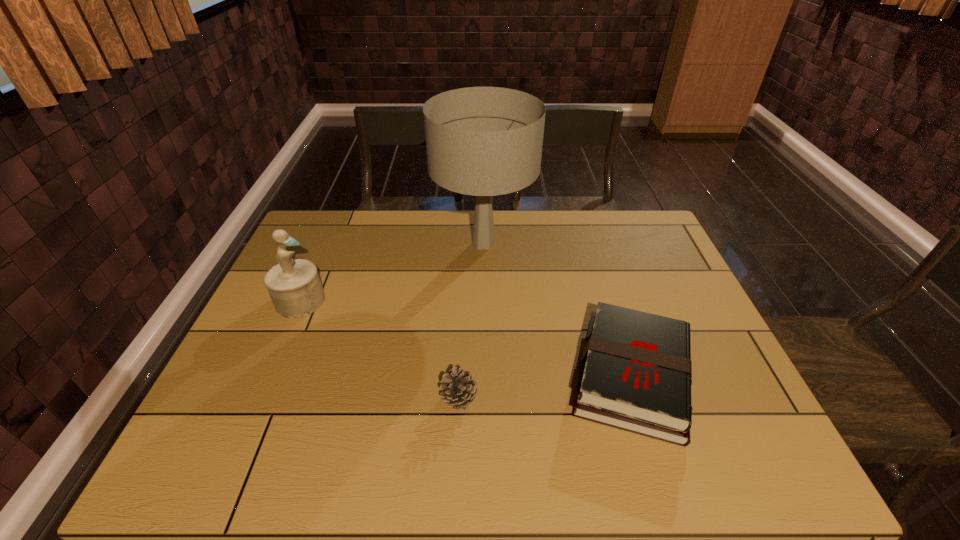
The width and height of the screenshot is (960, 540). Identify the location of free space between the lampshade and the pinecone. (471, 320).

Where is `empty space between the tallest object and the third shortest object`? The width and height of the screenshot is (960, 540). empty space between the tallest object and the third shortest object is located at coordinates (392, 272).

I want to click on free space that is in between the farthest object and the pinecone, so click(471, 320).

Identify which object is located as the third nearest to the leftmost object. Please provide its 2D coordinates. Your answer should be formatted as a tuple, i.e. [(x, y)], where the tuple contains the x and y coordinates of a point satisfying the conditions above.

[(636, 371)]

Where is `the closest object relative to the pinecone`? the closest object relative to the pinecone is located at coordinates (636, 371).

You are a GUI agent. You are given a task and a screenshot of the screen. Output one action in this format:
    pyautogui.click(x=<x>, y=<y>)
    Task: Click on the vacant space that satisfies the following two spatial constraints: 1. on the back side of the pinecone; 2. on the left side of the rightmost object
    
    Given the screenshot: What is the action you would take?
    pyautogui.click(x=460, y=376)

You are a GUI agent. You are given a task and a screenshot of the screen. Output one action in this format:
    pyautogui.click(x=<x>, y=<y>)
    Task: Click on the free space in the image that satisfies the following two spatial constraints: 1. on the front-facing side of the farthest object; 2. on the front side of the pinecone
    
    Given the screenshot: What is the action you would take?
    pyautogui.click(x=485, y=397)

This screenshot has width=960, height=540. I want to click on vacant area that satisfies the following two spatial constraints: 1. on the front-facing side of the lampshade; 2. on the right side of the rightmost object, so click(485, 376).

The height and width of the screenshot is (540, 960). Find the location of `free space that satisfies the following two spatial constraints: 1. on the front-facing side of the farthest object; 2. on the front side of the pinecone`. free space that satisfies the following two spatial constraints: 1. on the front-facing side of the farthest object; 2. on the front side of the pinecone is located at coordinates (485, 397).

Image resolution: width=960 pixels, height=540 pixels. I want to click on vacant region that satisfies the following two spatial constraints: 1. on the front-facing side of the tallest object; 2. on the left side of the rightmost object, so click(485, 376).